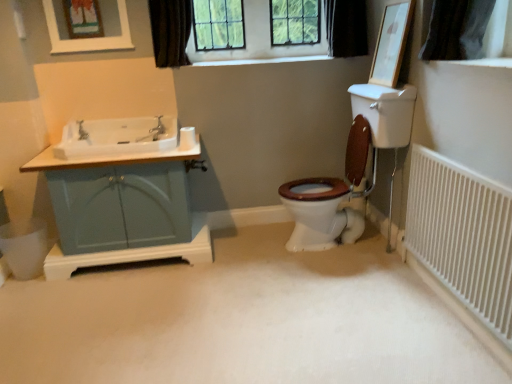
Identify the location of vacant space to the left of white metal radiator at lower right. The image size is (512, 384). (358, 321).